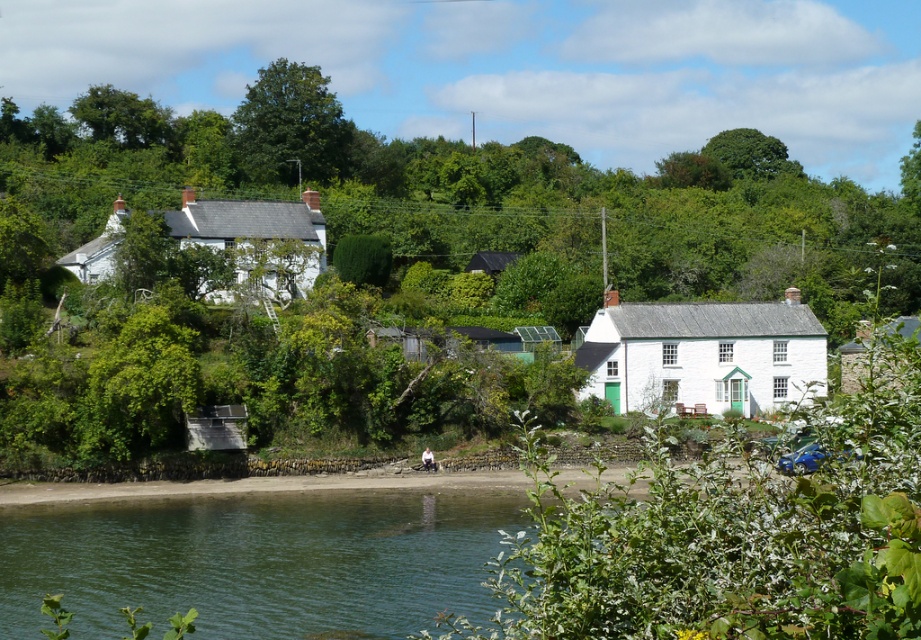
Question: Is white matte house at left wider than white matte house at right?

Choices:
 (A) no
 (B) yes

Answer: (A)

Question: Does white painted stone cottage at center-right have a smaller size compared to white matte house at right?

Choices:
 (A) yes
 (B) no

Answer: (A)

Question: Is green leafy tree at center wider than green leafy tree at upper center?

Choices:
 (A) yes
 (B) no

Answer: (A)

Question: Which point is closer to the camera?

Choices:
 (A) (339, 132)
 (B) (242, 115)

Answer: (A)

Question: Which of the following is the closest to the observer?

Choices:
 (A) (108, 256)
 (B) (688, 225)
 (C) (721, 349)
 (D) (284, 109)

Answer: (C)

Question: Which point is farther to the camera?

Choices:
 (A) green leafy tree at center
 (B) white matte house at left
 (C) white painted stone cottage at center-right
 (D) green leafy tree at upper center

Answer: (D)